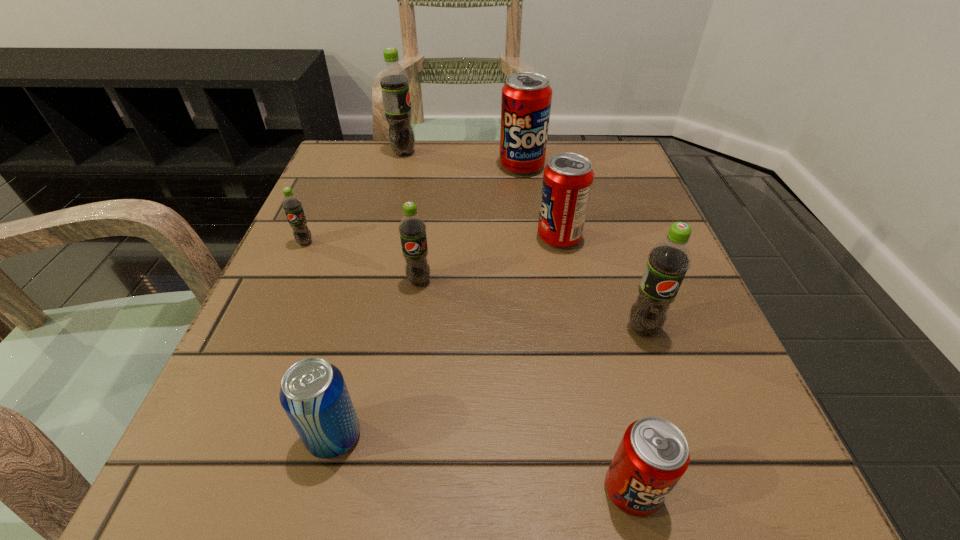
This screenshot has height=540, width=960. I want to click on the leftmost green soda, so click(x=292, y=206).

You are a GUI agent. You are given a task and a screenshot of the screen. Output one action in this format:
    pyautogui.click(x=<x>, y=<y>)
    Task: Click on the second farthest green soda
    The height and width of the screenshot is (540, 960).
    Given the screenshot: What is the action you would take?
    pyautogui.click(x=292, y=206)

Image resolution: width=960 pixels, height=540 pixels. Identify the location of the smallest red soda can. (653, 455).

Image resolution: width=960 pixels, height=540 pixels. What are the coordinates of `the nearest red soda can` in the screenshot? It's located at (653, 455).

Locate an element on the screen. The height and width of the screenshot is (540, 960). vacant space located on the front label of the tallest object is located at coordinates (567, 153).

Locate an element on the screen. The width and height of the screenshot is (960, 540). free space located on the front of the farthest red soda can is located at coordinates (538, 288).

The image size is (960, 540). Find the location of `vacant space situated 0.200m on the front label of the rightmost object`. vacant space situated 0.200m on the front label of the rightmost object is located at coordinates (695, 482).

The image size is (960, 540). What are the coordinates of `vacant region located 0.160m on the front label of the fifth farthest soda can` in the screenshot? It's located at (406, 372).

The width and height of the screenshot is (960, 540). I want to click on vacant space situated 0.230m on the back of the second biggest red soda can, so click(544, 164).

Locate an element on the screen. vacant region located 0.090m on the right of the seventh farthest object is located at coordinates (434, 436).